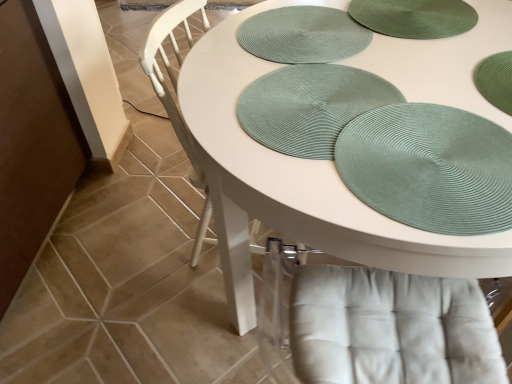
The height and width of the screenshot is (384, 512). Find the location of `vacant point above green textured placemat at upper right (from a real-world perspective)`. vacant point above green textured placemat at upper right (from a real-world perspective) is located at coordinates (436, 158).